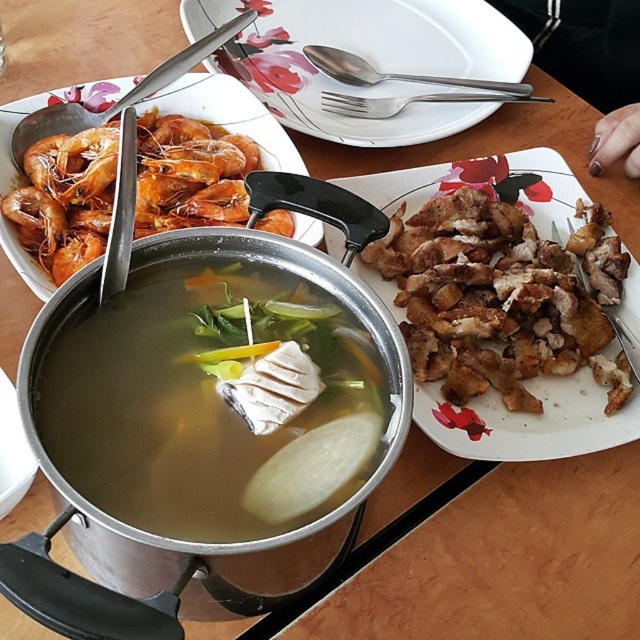
You are a food critic sitting at the table. You want to taste the brown crispy chicken at right and the orange matte shrimp at left. Which dish is closer to you?

The brown crispy chicken at right is closer to you because it is placed below the orange matte shrimp at left, indicating it is positioned lower and nearer in the visual hierarchy.

You are a food delivery person who needs to deliver the orange matte shrimp at left and the brown crispy chicken at right. The customer mentioned they want the shrimp first. Based on their positions in the image, which one should you pick up first?

The orange matte shrimp at left is behind the brown crispy chicken at right, so you should pick up the brown crispy chicken at right first as it is closer to you.

You are a food critic inspecting the meal setup on the wooden table. You notice the white glossy plate at upper center and the orange matte shrimp at left. Which object is placed higher in the image?

The white glossy plate at upper center is positioned over the orange matte shrimp at left, so it is higher in the image.